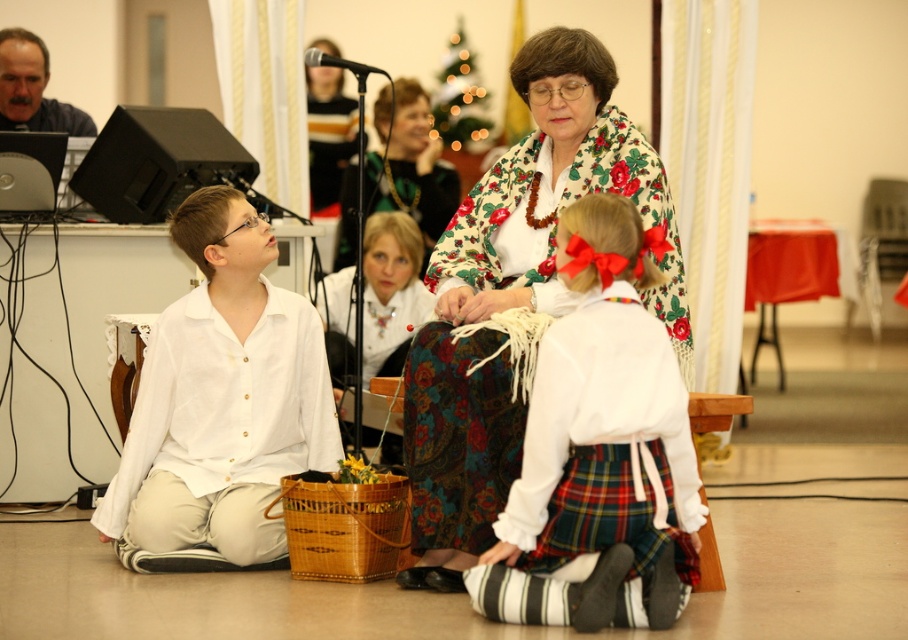
Where is the white cotton blouse at center located in the image?

The white cotton blouse at center is located at point (600,449) in the image.

You are a photographer standing in the scene and want to take a photo of both the white cotton blouse at center and the white linen shirt at left. The camera can only focus on objects within a 3 feet range. Can you capture both in one shot without moving the camera?

The white cotton blouse at center is 3.77 feet away from the white linen shirt at left. Since the distance between them is greater than 3 feet, the camera cannot focus on both in a single shot without moving the camera.

What is the object located at the point with coordinates (600, 449) in the image?

The point at coordinates (600, 449) marks the white cotton blouse at center.